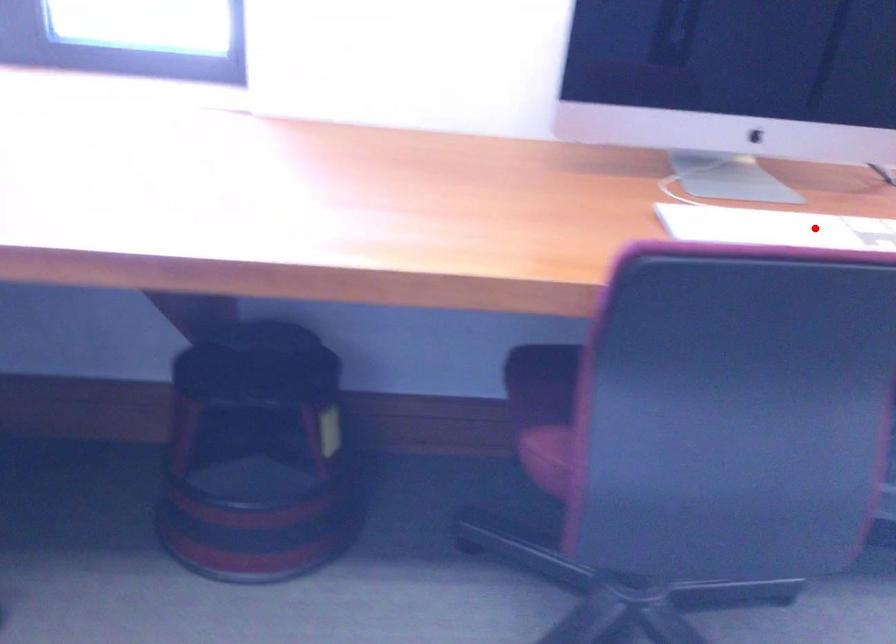
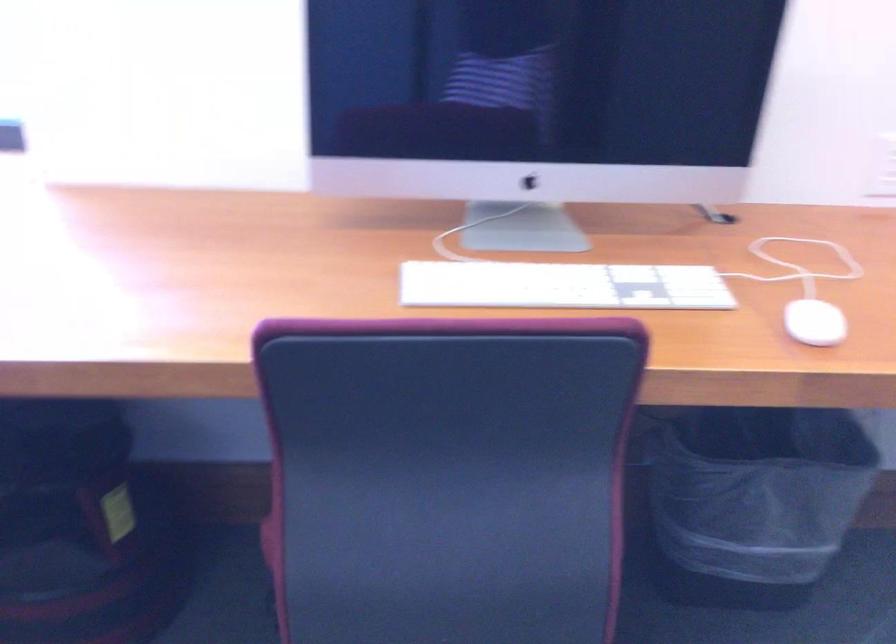
Find the pixel in the second image that matches the highlighted location in the first image.

(562, 285)